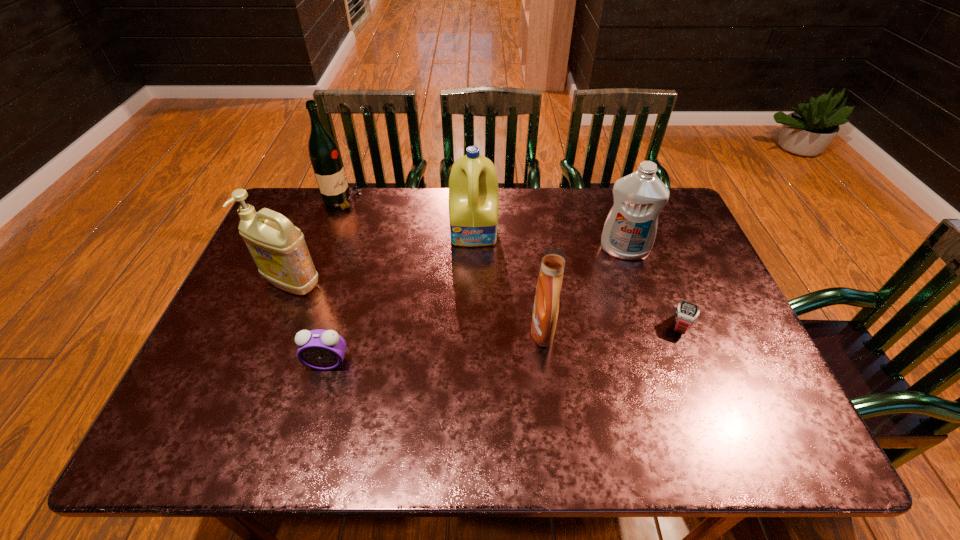
Find the location of `free space between the sixth tallest object and the rightmost detergent`. free space between the sixth tallest object and the rightmost detergent is located at coordinates (475, 307).

Locate an element on the screen. This screenshot has width=960, height=540. the closest object to the third farthest detergent is located at coordinates (324, 350).

Point out which object is positioned as the third nearest to the fourth object from right to left. Please provide its 2D coordinates. Your answer should be formatted as a tuple, i.e. [(x, y)], where the tuple contains the x and y coordinates of a point satisfying the conditions above.

[(324, 154)]

This screenshot has width=960, height=540. I want to click on detergent that stands as the second closest to the rightmost detergent, so click(473, 185).

Point out which detergent is positioned as the nearest to the alarm clock. Please provide its 2D coordinates. Your answer should be formatted as a tuple, i.e. [(x, y)], where the tuple contains the x and y coordinates of a point satisfying the conditions above.

[(278, 248)]

The width and height of the screenshot is (960, 540). In order to click on blank space that satisfies the following two spatial constraints: 1. on the front-facing side of the third detergent from left to right; 2. on the face of the nearest object in this screenshot , I will do pos(546,363).

At what (x,y) coordinates should I click in order to perform the action: click on free location that satisfies the following two spatial constraints: 1. on the front-facing side of the second detergent from right to left; 2. on the face of the nearest object. Please return your answer as a coordinate pair (x, y). This screenshot has height=540, width=960. Looking at the image, I should click on (546, 363).